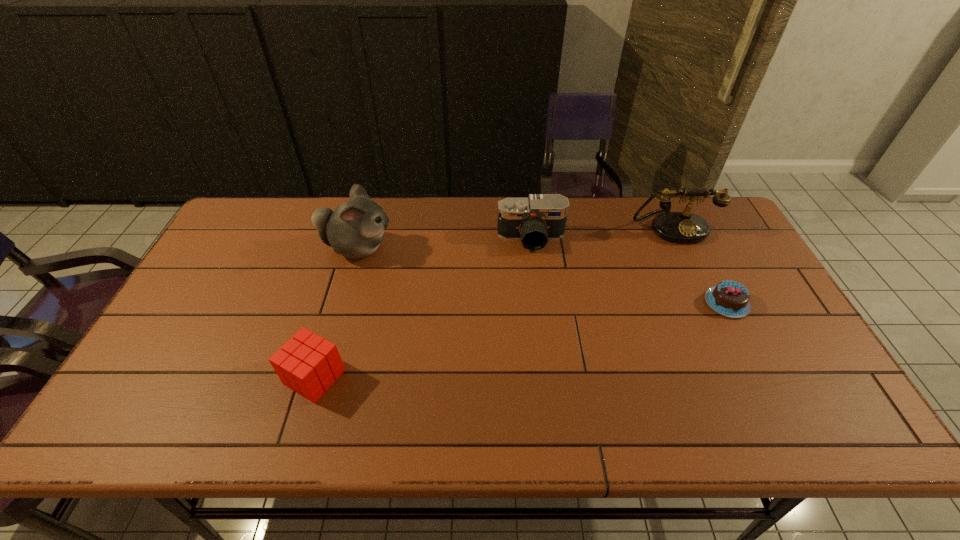
Identify the location of vacant area that lies between the tallest object and the shortest object. (542, 275).

Where is `free point between the second shortest object and the telephone`? This screenshot has width=960, height=540. free point between the second shortest object and the telephone is located at coordinates (493, 301).

Where is `vacant point located between the shortest object and the hamster`? This screenshot has height=540, width=960. vacant point located between the shortest object and the hamster is located at coordinates (542, 275).

The height and width of the screenshot is (540, 960). I want to click on vacant space in between the camera and the nearest object, so click(x=422, y=308).

Identify the location of the closest object to the shortest object. The width and height of the screenshot is (960, 540). (678, 227).

Locate an element on the screen. the second closest object to the third shortest object is located at coordinates (354, 229).

I want to click on free location that satisfies the following two spatial constraints: 1. on the front-facing side of the chocolate cake; 2. on the left side of the camera, so click(x=539, y=303).

The height and width of the screenshot is (540, 960). Find the location of `free spot that satisfies the following two spatial constraints: 1. on the dial of the shortest object; 2. on the right side of the telephone`. free spot that satisfies the following two spatial constraints: 1. on the dial of the shortest object; 2. on the right side of the telephone is located at coordinates (708, 303).